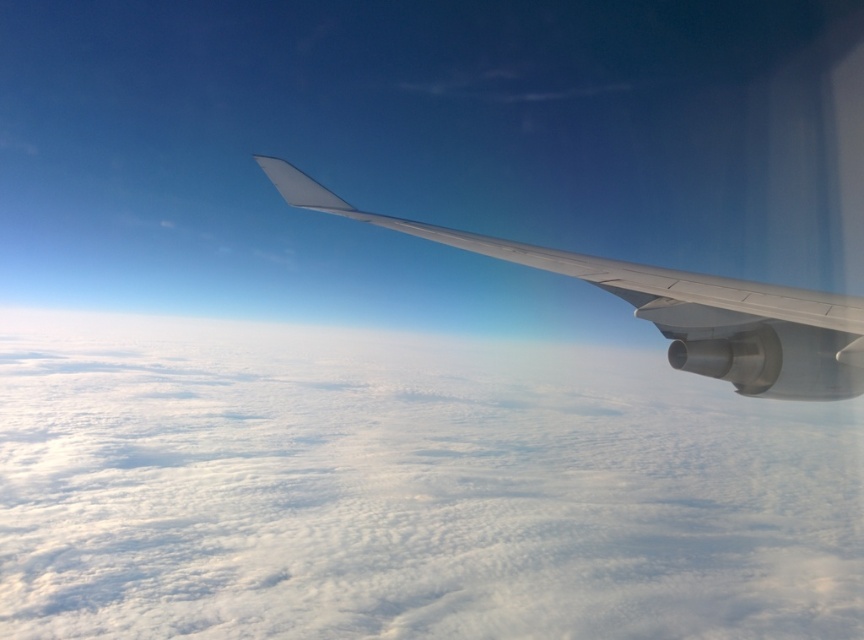
Question: Is white fluffy cloud at upper center positioned in front of white matte wing at upper right?

Choices:
 (A) yes
 (B) no

Answer: (B)

Question: Which point is closer to the camera?

Choices:
 (A) (607, 273)
 (B) (551, 348)

Answer: (A)

Question: From the image, what is the correct spatial relationship of white fluffy cloud at upper center in relation to white matte wing at upper right?

Choices:
 (A) left
 (B) right

Answer: (A)

Question: Does white fluffy cloud at upper center have a greater width compared to white matte wing at upper right?

Choices:
 (A) yes
 (B) no

Answer: (A)

Question: Among these objects, which one is nearest to the camera?

Choices:
 (A) white fluffy cloud at upper center
 (B) white matte wing at upper right

Answer: (B)